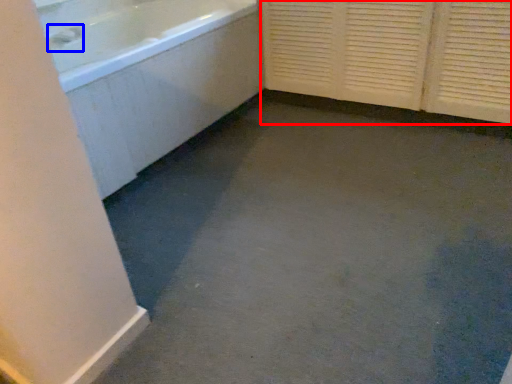
Question: Which point is closer to the camera, screen door (highlighted by a red box) or faucet (highlighted by a blue box)?

Choices:
 (A) screen door
 (B) faucet

Answer: (A)